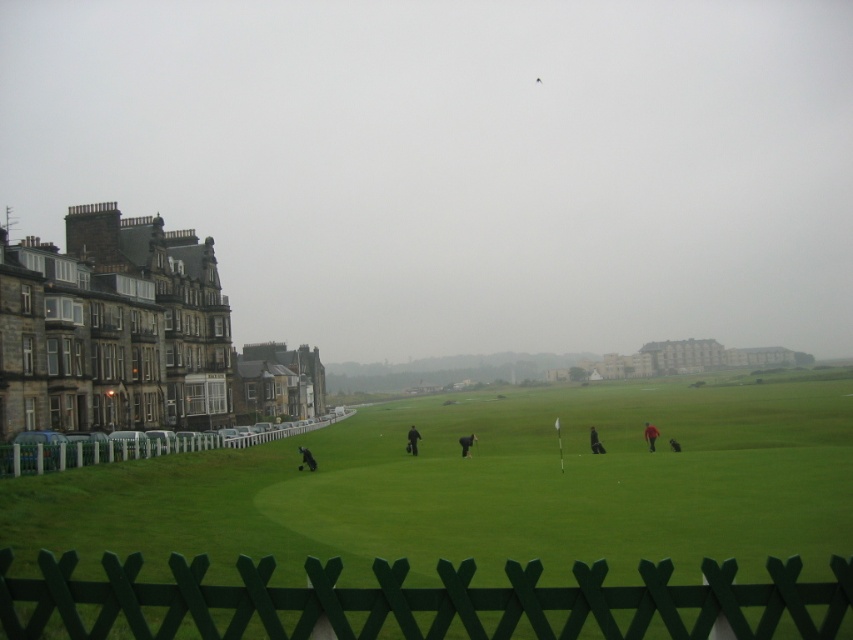
You are standing at the point marked by the coordinates (x=421, y=600) on the golf course. What object are you directly facing?

The point marked by the coordinates (x=421, y=600) is directly facing the green wooden fence at lower center.

You are a golfer standing on the fairway and see the dark gray jacket at center and the dark gray fabric person at center. Which one is closer to you?

The dark gray jacket at center is positioned under the dark gray fabric person at center, meaning it is closer to you.

From the picture: You are standing on the golf course and want to walk towards the green grass at center. However, there is a green wooden fence at lower center in your path. Can you step over the fence to reach the grass?

The green grass at center is further to the viewer than the green wooden fence at lower center, meaning the fence is closer to you. Therefore, you cannot step over the fence to reach the grass since it is in front of you.